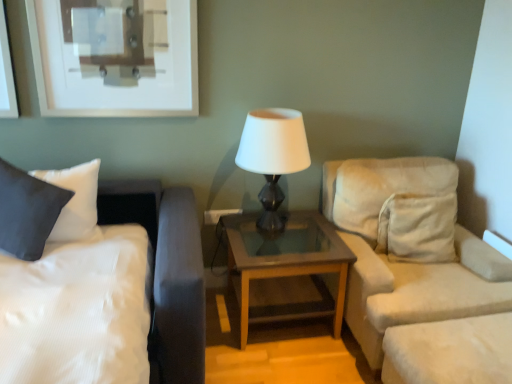
Question: Does white glossy lamp at center appear on the right side of beige fabric studio couch at right?

Choices:
 (A) yes
 (B) no

Answer: (B)

Question: Does white glossy lamp at center touch beige fabric studio couch at right?

Choices:
 (A) yes
 (B) no

Answer: (B)

Question: Does white glossy lamp at center have a lesser width compared to beige fabric studio couch at right?

Choices:
 (A) no
 (B) yes

Answer: (B)

Question: From the image's perspective, is white glossy lamp at center beneath beige fabric studio couch at right?

Choices:
 (A) no
 (B) yes

Answer: (A)

Question: Can you confirm if white glossy lamp at center is bigger than beige fabric studio couch at right?

Choices:
 (A) yes
 (B) no

Answer: (B)

Question: Considering their positions, is white glossy lamp at center located in front of or behind satin white bed at left?

Choices:
 (A) behind
 (B) front

Answer: (A)

Question: From a real-world perspective, is white glossy lamp at center physically located above or below satin white bed at left?

Choices:
 (A) above
 (B) below

Answer: (A)

Question: From the image's perspective, is white glossy lamp at center positioned above or below satin white bed at left?

Choices:
 (A) above
 (B) below

Answer: (A)

Question: Is white glossy lamp at center spatially inside satin white bed at left, or outside of it?

Choices:
 (A) outside
 (B) inside

Answer: (A)

Question: Considering the relative positions of satin white bed at left and brown wood/glass table at center in the image provided, is satin white bed at left to the left or to the right of brown wood/glass table at center?

Choices:
 (A) right
 (B) left

Answer: (B)

Question: Considering the positions of satin white bed at left and brown wood/glass table at center in the image, is satin white bed at left bigger or smaller than brown wood/glass table at center?

Choices:
 (A) small
 (B) big

Answer: (B)

Question: In terms of height, does satin white bed at left look taller or shorter compared to brown wood/glass table at center?

Choices:
 (A) short
 (B) tall

Answer: (B)

Question: From a real-world perspective, is satin white bed at left positioned above or below brown wood/glass table at center?

Choices:
 (A) below
 (B) above

Answer: (B)

Question: In terms of width, does white glossy lamp at center look wider or thinner when compared to beige fabric studio couch at right?

Choices:
 (A) thin
 (B) wide

Answer: (A)

Question: Is white glossy lamp at center situated inside beige fabric studio couch at right or outside?

Choices:
 (A) outside
 (B) inside

Answer: (A)